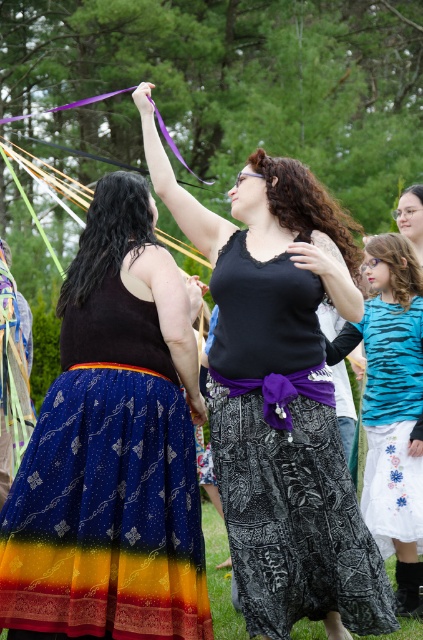
Question: Among these objects, which one is farthest from the camera?

Choices:
 (A) blue tiger stripe shirt at center
 (B) black printed skirt at center
 (C) blue printed skirt at center

Answer: (A)

Question: Is blue printed skirt at center wider than black printed skirt at center?

Choices:
 (A) no
 (B) yes

Answer: (B)

Question: Does blue printed skirt at center have a lesser width compared to black printed skirt at center?

Choices:
 (A) no
 (B) yes

Answer: (A)

Question: Among these points, which one is farthest from the camera?

Choices:
 (A) (145, 372)
 (B) (412, 269)

Answer: (B)

Question: Which point is closer to the camera taking this photo?

Choices:
 (A) (115, 488)
 (B) (392, 241)
 (C) (252, 417)

Answer: (A)

Question: Is the position of black printed skirt at center less distant than that of blue tiger stripe shirt at center?

Choices:
 (A) yes
 (B) no

Answer: (A)